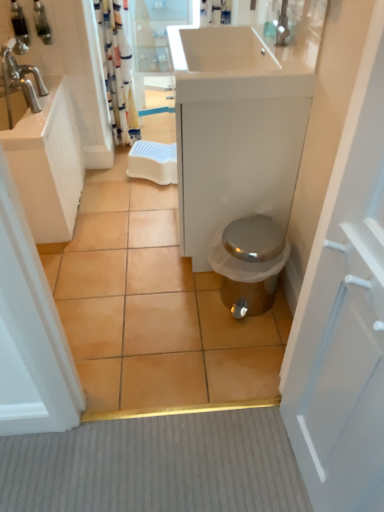
Question: From a real-world perspective, is white glossy sink at upper center positioned above or below brown ceramic tile at center?

Choices:
 (A) below
 (B) above

Answer: (B)

Question: From the image's perspective, is white glossy sink at upper center located above or below brown ceramic tile at center?

Choices:
 (A) below
 (B) above

Answer: (B)

Question: Estimate the real-world distances between objects in this image. Which object is closer to the silver metallic toilet at center?

Choices:
 (A) white glossy door at right
 (B) brown ceramic tile at center
 (C) white glossy cabinet at center
 (D) transparent glass door at upper center
 (E) white glossy sink at upper left

Answer: (B)

Question: Considering the real-world distances, which object is farthest from the white glossy sink at upper center?

Choices:
 (A) translucent plastic soap dispenser at upper left, which is counted as the second toiletry, starting from the left
 (B) brushed metal soap dispenser at upper left, the 2th toiletry when ordered from right to left
 (C) white glossy cabinet at center
 (D) brown ceramic tile at center
 (E) transparent glass door at upper center

Answer: (B)